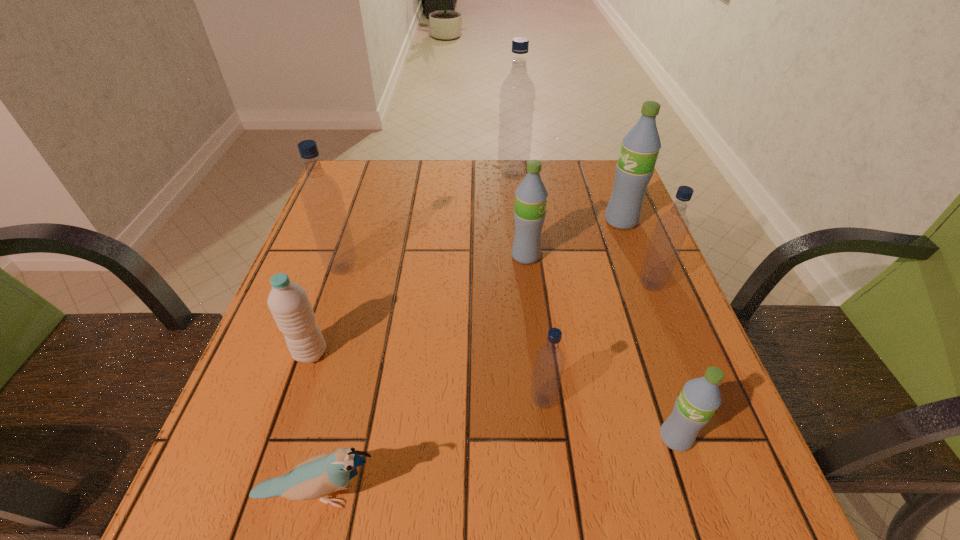
The width and height of the screenshot is (960, 540). Find the location of `the biggest blue water bottle`. the biggest blue water bottle is located at coordinates (517, 94).

The image size is (960, 540). Identify the location of the farthest water bottle. (517, 94).

Locate an element on the screen. The image size is (960, 540). the biggest green water bottle is located at coordinates (640, 147).

Where is `the second farthest water bottle`? The width and height of the screenshot is (960, 540). the second farthest water bottle is located at coordinates (640, 147).

Identify the location of the leftmost blue water bottle. (321, 195).

You are a GUI agent. You are given a task and a screenshot of the screen. Output one action in this format:
    pyautogui.click(x=<x>, y=<y>)
    Task: Click on the second smallest green water bottle
    This screenshot has width=960, height=540.
    Given the screenshot: What is the action you would take?
    (x=531, y=195)

In order to click on the second nearest green water bottle in this screenshot , I will do `click(531, 195)`.

Image resolution: width=960 pixels, height=540 pixels. Identify the location of the second smallest blue water bottle. (671, 229).

Find the location of a particular element. Image resolution: width=960 pixels, height=540 pixels. the sixth farthest water bottle is located at coordinates (288, 302).

Identify the location of white water bottle. (x=288, y=302).